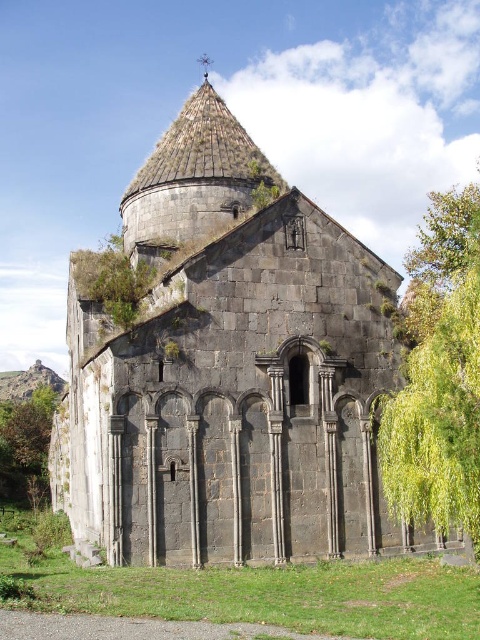
Which is in front, point (86, 524) or point (443, 422)?

Point (443, 422)

Is point (372, 461) behind point (425, 486)?

Yes.

The width and height of the screenshot is (480, 640). Find the location of `dark gray stone church at center`. dark gray stone church at center is located at coordinates (228, 369).

Is green leafy tree at right thinner than green leafy tree at lower left?

No.

Between point (439, 508) and point (19, 440), which one is positioned in front?

Point (439, 508) is more forward.

You are a GUI agent. You are given a task and a screenshot of the screen. Output one action in this format:
    pyautogui.click(x=<x>, y=<y>)
    Task: Click on the green leafy tree at right
    
    Given the screenshot: What is the action you would take?
    pyautogui.click(x=439, y=376)

Locate an element on the screen. green leafy tree at right is located at coordinates (439, 376).

Does dark gray stone church at center have a greater width compared to green leafy tree at lower left?

Indeed, dark gray stone church at center has a greater width compared to green leafy tree at lower left.

Is dark gray stone church at center smaller than green leafy tree at lower left?

Incorrect, dark gray stone church at center is not smaller in size than green leafy tree at lower left.

Measure the distance between point (224, 557) and camera.

The distance of point (224, 557) from camera is 42.39 meters.

You are a GUI agent. You are given a task and a screenshot of the screen. Output one action in this format:
    pyautogui.click(x=<x>, y=<y>)
    Task: Click on the dark gray stone church at center
    The image size is (480, 640).
    Given the screenshot: What is the action you would take?
    pyautogui.click(x=228, y=369)